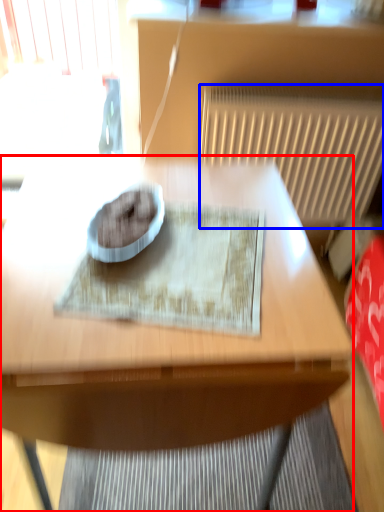
Question: Which point is closer to the camera, table (highlighted by a red box) or radiator (highlighted by a blue box)?

Choices:
 (A) table
 (B) radiator

Answer: (A)